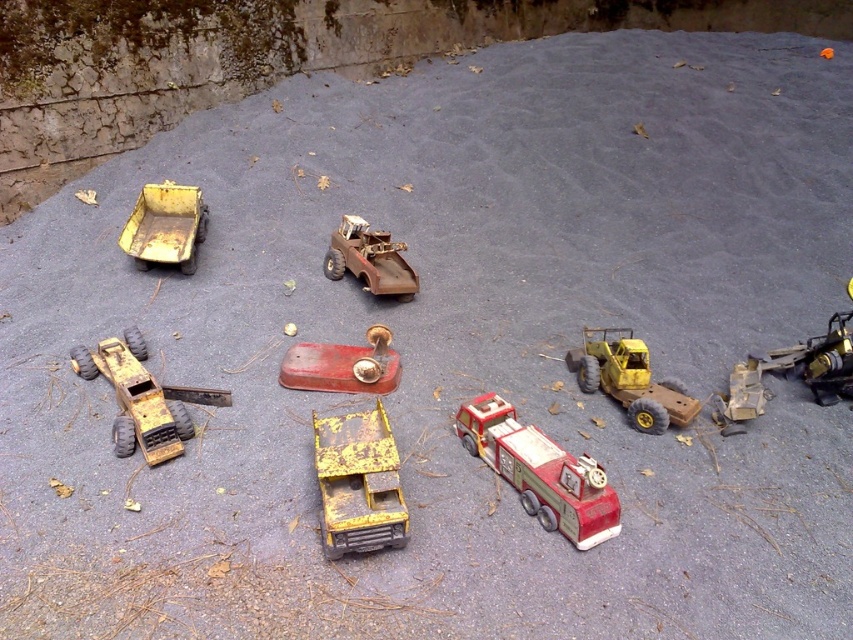
Does yellow matte tractor at right have a greater height compared to rusty metal truck at center?

Incorrect, yellow matte tractor at right's height is not larger of rusty metal truck at center's.

Which is more to the left, yellow matte tractor at right or rusty metal truck at center?

Positioned to the left is rusty metal truck at center.

What do you see at coordinates (630, 380) in the screenshot?
I see `yellow matte tractor at right` at bounding box center [630, 380].

Locate an element on the screen. The image size is (853, 640). yellow matte tractor at right is located at coordinates (630, 380).

Is red matte fire truck at center closer to camera compared to yellow matte truck at upper left?

Yes.

Between red matte fire truck at center and yellow matte truck at upper left, which one has more height?

Standing taller between the two is yellow matte truck at upper left.

Measure the distance between red matte fire truck at center and camera.

red matte fire truck at center is 7.34 feet away from camera.

Where is `red matte fire truck at center`? The image size is (853, 640). red matte fire truck at center is located at coordinates (541, 472).

Which of these two, red matte fire truck at center or yellow matte truck at center, stands shorter?

red matte fire truck at center

You are a GUI agent. You are given a task and a screenshot of the screen. Output one action in this format:
    pyautogui.click(x=<x>, y=<y>)
    Task: Click on the red matte fire truck at center
    The width and height of the screenshot is (853, 640).
    Given the screenshot: What is the action you would take?
    pyautogui.click(x=541, y=472)

What do you see at coordinates (541, 472) in the screenshot? I see `red matte fire truck at center` at bounding box center [541, 472].

Where is `red matte fire truck at center`? This screenshot has width=853, height=640. red matte fire truck at center is located at coordinates (541, 472).